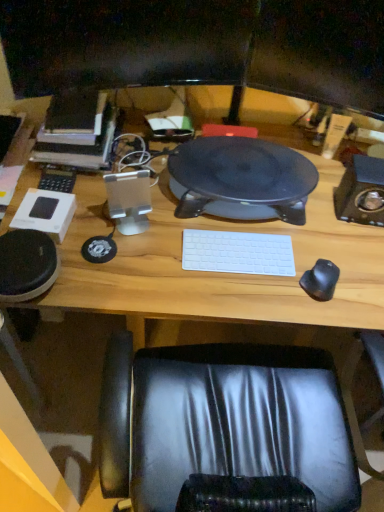
Identify the location of vacant area that is in front of black rubber mouse at right. (321, 313).